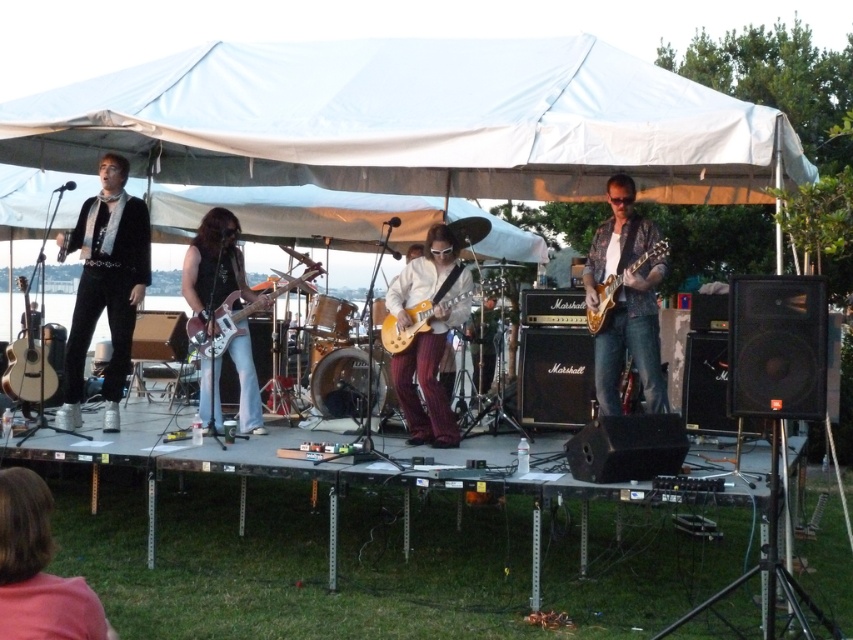
Does shiny brown leather guitar at center appear over glossy electric guitar at center?

No.

Is shiny brown leather guitar at center smaller than glossy electric guitar at center?

No, shiny brown leather guitar at center is not smaller than glossy electric guitar at center.

Is point (213, 420) more distant than point (612, 291)?

Yes, it is.

Find the location of a particular element. shiny brown leather guitar at center is located at coordinates (215, 266).

Between shiny brown leather guitar at center and yellow matte electric guitar at center, which one appears on the right side from the viewer's perspective?

yellow matte electric guitar at center

Who is lower down, shiny brown leather guitar at center or yellow matte electric guitar at center?

shiny brown leather guitar at center

You are a GUI agent. You are given a task and a screenshot of the screen. Output one action in this format:
    pyautogui.click(x=<x>, y=<y>)
    Task: Click on the shiny brown leather guitar at center
    The image size is (853, 640).
    Given the screenshot: What is the action you would take?
    pyautogui.click(x=215, y=266)

What do you see at coordinates (38, 570) in the screenshot? I see `pink fabric at lower left` at bounding box center [38, 570].

Which is behind, point (39, 621) or point (216, 408)?

Positioned behind is point (216, 408).

Measure the distance between point (64, 632) and camera.

The distance of point (64, 632) from camera is 2.73 meters.

Identify the location of pink fabric at lower left. The image size is (853, 640). (38, 570).